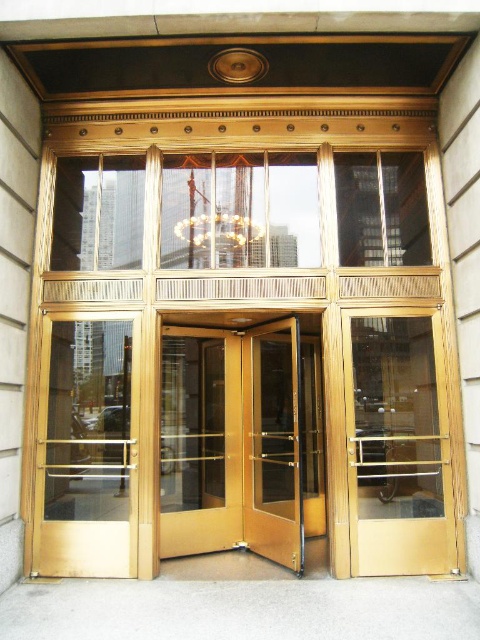
You are standing at the entrance of the grand building and notice two points marked on the ceiling above the revolving doors. The first point is at coordinates point (333, 403) and the second is at point (110, 408). Which point is closer to your eyes?

Point (333, 403) is closer to the viewer than point (110, 408).

You are an architect designing a new building and want to ensure that the gold polished elevator at center and the matte gold door at left are proportionate to each other. Based on the scene, which object should be scaled down to achieve a balanced design?

The gold polished elevator at center is bigger than the matte gold door at left, so to achieve a balanced design, the gold polished elevator at center should be scaled down.